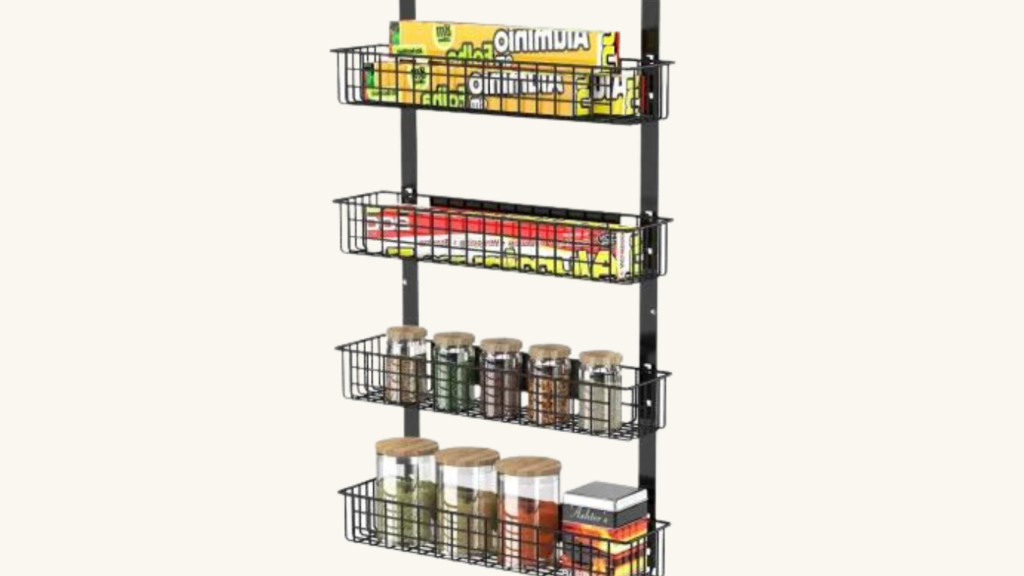
At what (x,y) coordinates should I click in order to perform the action: click on the right of pantry shelf organizer. Please return your answer as a coordinate pair (x, y). This screenshot has width=1024, height=576. Looking at the image, I should click on (725, 206).